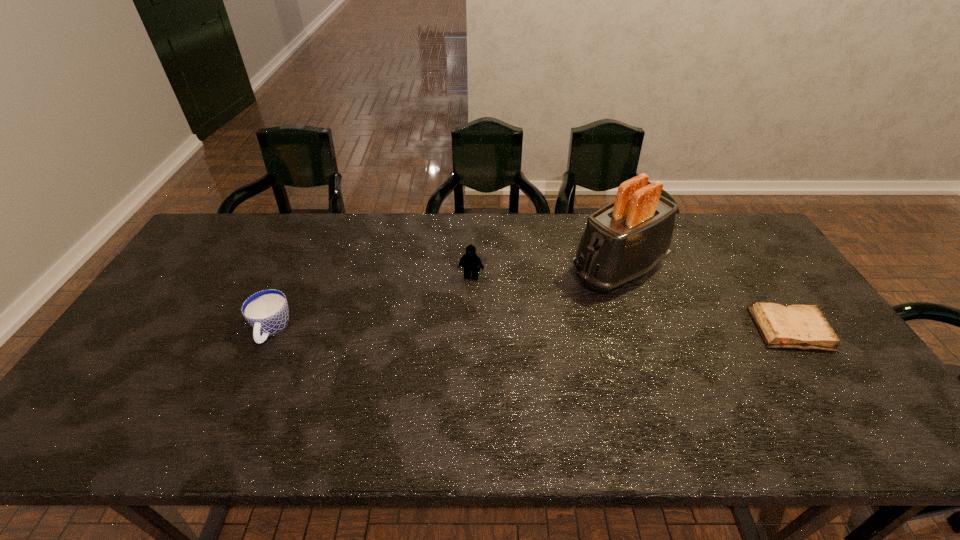
Identify the location of the third tallest object. (267, 311).

At what (x,y) coordinates should I click in order to perform the action: click on the leftmost object. Please return your answer as a coordinate pair (x, y). The image size is (960, 540). Looking at the image, I should click on (267, 311).

This screenshot has width=960, height=540. In order to click on the shortest object in this screenshot , I will do `click(804, 327)`.

Image resolution: width=960 pixels, height=540 pixels. Identify the location of diary. (804, 327).

Locate an element on the screen. The image size is (960, 540). the second object from right to left is located at coordinates coord(625,239).

At what (x,y) coordinates should I click in order to perform the action: click on the tallest object. Please return your answer as a coordinate pair (x, y). Looking at the image, I should click on (625, 239).

The image size is (960, 540). I want to click on the third shortest object, so click(x=470, y=260).

This screenshot has width=960, height=540. I want to click on the third object from right to left, so click(470, 260).

At what (x,y) coordinates should I click in order to perform the action: click on free space located 0.130m on the side of the leftmost object with the handle. Please return your answer as a coordinate pair (x, y). The width and height of the screenshot is (960, 540). Looking at the image, I should click on (243, 396).

Find the location of a particular element. vacant area located 0.170m on the left of the rightmost object is located at coordinates [693, 329].